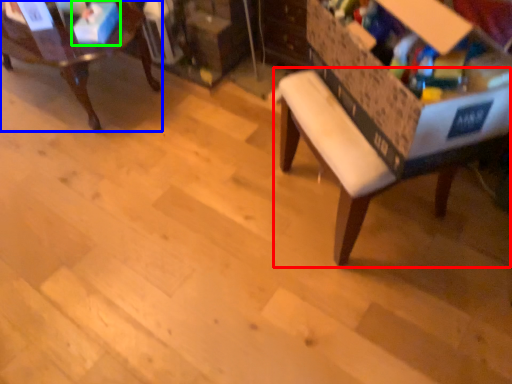
Question: Estimate the real-world distances between objects in this image. Which object is farther from table (highlighted by a red box), chair (highlighted by a blue box) or storage box (highlighted by a green box)?

Choices:
 (A) chair
 (B) storage box

Answer: (A)